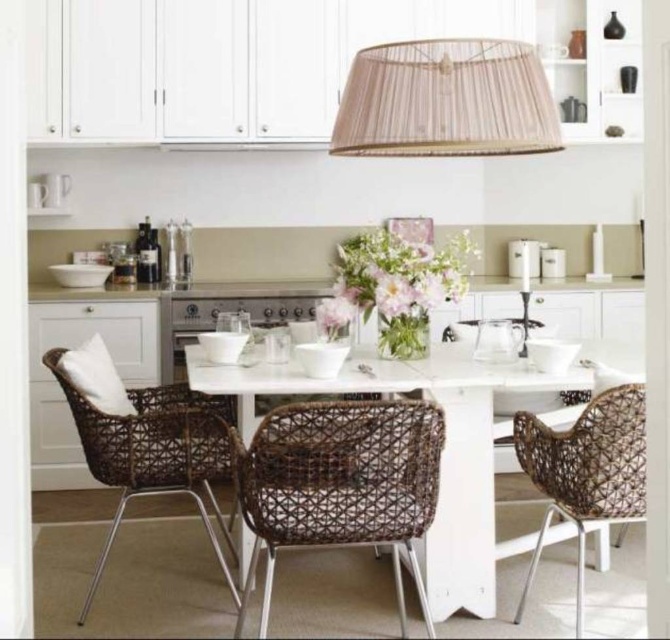
Can you confirm if brown wicker chair at left is positioned to the right of brown woven chair at right?

No, brown wicker chair at left is not to the right of brown woven chair at right.

Based on the photo, who is shorter, brown wicker chair at left or brown woven chair at right?

brown woven chair at right is shorter.

Is point (192, 464) farther from camera compared to point (519, 460)?

No, (192, 464) is in front of (519, 460).

Where is `brown wicker chair at left`? The width and height of the screenshot is (670, 640). brown wicker chair at left is located at coordinates (155, 452).

Between brown woven chair at right and brown wicker chair at center, which one appears on the left side from the viewer's perspective?

Positioned to the left is brown wicker chair at center.

Is brown woven chair at right wider than brown wicker chair at center?

No, brown woven chair at right is not wider than brown wicker chair at center.

Between point (608, 396) and point (547, 408), which one is positioned in front?

Positioned in front is point (608, 396).

You are a GUI agent. You are given a task and a screenshot of the screen. Output one action in this format:
    pyautogui.click(x=<x>, y=<y>)
    Task: Click on the brown woven chair at right
    The height and width of the screenshot is (640, 670).
    Given the screenshot: What is the action you would take?
    pyautogui.click(x=586, y=470)

Can you confirm if rattan chair at center is thinner than brown wicker chair at left?

Indeed, rattan chair at center has a lesser width compared to brown wicker chair at left.

Which is more to the right, rattan chair at center or brown wicker chair at left?

Positioned to the right is rattan chair at center.

Is point (279, 456) farther from camera compared to point (139, 408)?

No.

Where is `rattan chair at center`? Image resolution: width=670 pixels, height=640 pixels. rattan chair at center is located at coordinates (340, 483).